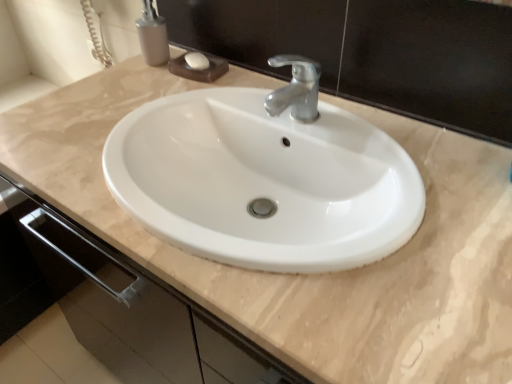
Question: Is white glossy soap at upper center placed right next to matte gray soap dispenser at upper left?

Choices:
 (A) no
 (B) yes

Answer: (B)

Question: Does white glossy soap at upper center lie behind matte gray soap dispenser at upper left?

Choices:
 (A) yes
 (B) no

Answer: (A)

Question: From the image's perspective, is white glossy soap at upper center located above matte gray soap dispenser at upper left?

Choices:
 (A) yes
 (B) no

Answer: (B)

Question: Is white glossy soap at upper center thinner than matte gray soap dispenser at upper left?

Choices:
 (A) yes
 (B) no

Answer: (A)

Question: Is white glossy soap at upper center surrounding matte gray soap dispenser at upper left?

Choices:
 (A) yes
 (B) no

Answer: (B)

Question: Considering the relative positions of white glossy soap at upper center and matte gray soap dispenser at upper left in the image provided, is white glossy soap at upper center to the right of matte gray soap dispenser at upper left from the viewer's perspective?

Choices:
 (A) yes
 (B) no

Answer: (A)

Question: Considering the relative sizes of matte gray soap dispenser at upper left and white glossy soap at upper center in the image provided, is matte gray soap dispenser at upper left taller than white glossy soap at upper center?

Choices:
 (A) no
 (B) yes

Answer: (B)

Question: Does matte gray soap dispenser at upper left have a larger size compared to white glossy soap at upper center?

Choices:
 (A) no
 (B) yes

Answer: (B)

Question: Is white glossy soap at upper center completely or partially inside matte gray soap dispenser at upper left?

Choices:
 (A) yes
 (B) no

Answer: (B)

Question: Are matte gray soap dispenser at upper left and white glossy soap at upper center making contact?

Choices:
 (A) yes
 (B) no

Answer: (A)

Question: Is matte gray soap dispenser at upper left oriented towards white glossy soap at upper center?

Choices:
 (A) no
 (B) yes

Answer: (A)

Question: Is matte gray soap dispenser at upper left shorter than white glossy soap at upper center?

Choices:
 (A) no
 (B) yes

Answer: (A)

Question: From the image's perspective, is white glossy soap at upper center above or below matte gray soap dispenser at upper left?

Choices:
 (A) above
 (B) below

Answer: (B)